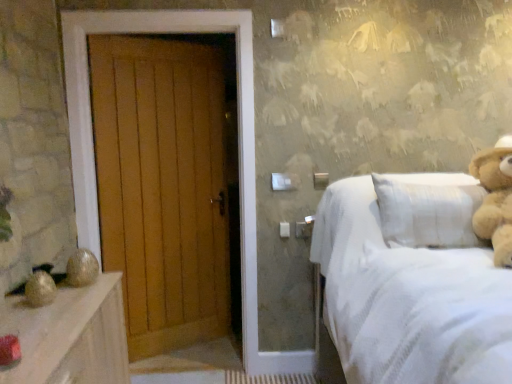
Question: Is point (476, 165) positioned closer to the camera than point (380, 228)?

Choices:
 (A) closer
 (B) farther

Answer: (B)

Question: Is light brown plush teddy bear at right bigger or smaller than white textured bed at right?

Choices:
 (A) small
 (B) big

Answer: (A)

Question: Based on their relative distances, which object is farther from the wooden door at left?

Choices:
 (A) white textured bed at right
 (B) light brown plush teddy bear at right

Answer: (B)

Question: Considering the real-world distances, which object is farthest from the wooden door at left?

Choices:
 (A) white textured bed at right
 (B) light brown plush teddy bear at right

Answer: (B)